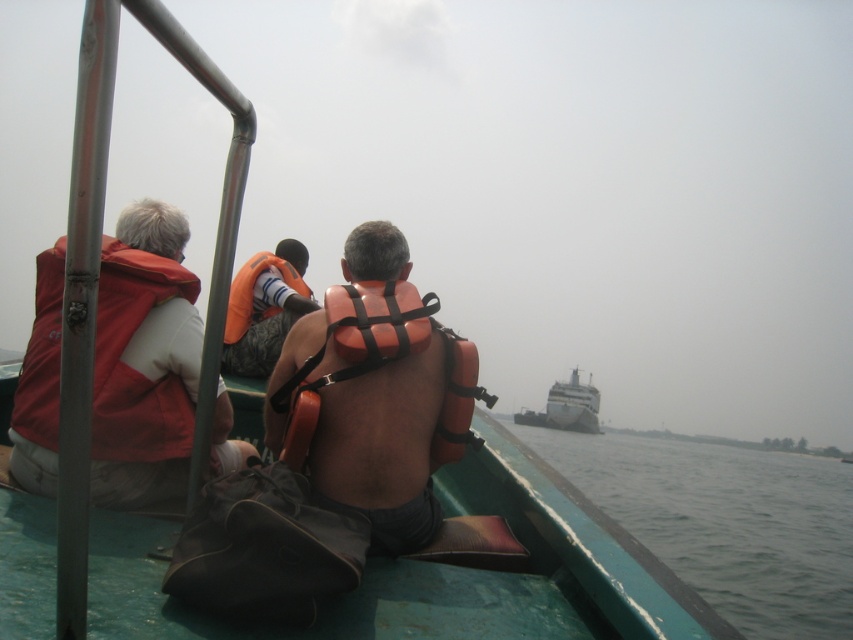
You are standing on the boat and want to reach a point marked at coordinates point (126, 401). If your reach extends 6 feet, can you reach that point without moving?

The distance of point (126, 401) from camera is 7.56 feet, so you cannot reach it with a 6 feet reach since it is farther away.

You are navigating a small boat in low visibility conditions. You notice two points marked on your radar screen. The first point is labeled as point (410,371) and the second as point (558,403). According to the scene description, which point is closer to the front of the boat?

Point (410,371) is in front of point (558,403), so the first point is closer to the front of the boat.

You are a safety inspector checking the boat for proper equipment. You notice two orange flotation devices at the center of the boat. Which one is wider, the matte orange life vest at center or the orange life jacket at center?

The matte orange life vest at center might be wider than orange life jacket at center according to the description.